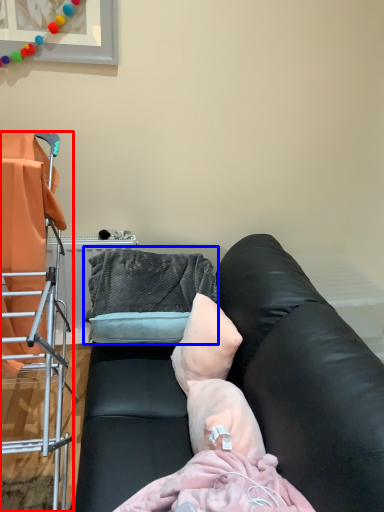
Question: Which point is further to the camera, furniture (highlighted by a red box) or bean bag chair (highlighted by a blue box)?

Choices:
 (A) furniture
 (B) bean bag chair

Answer: (B)